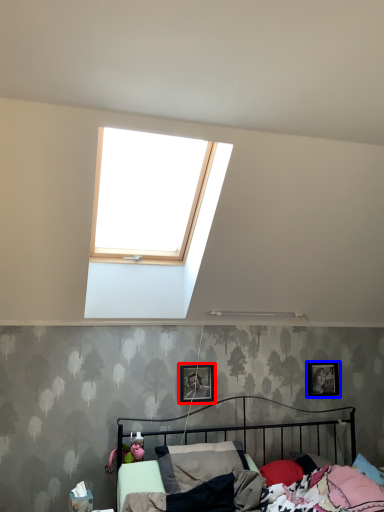
Question: Which object is closer to the camera taking this photo, picture frame (highlighted by a red box) or picture frame (highlighted by a blue box)?

Choices:
 (A) picture frame
 (B) picture frame

Answer: (A)